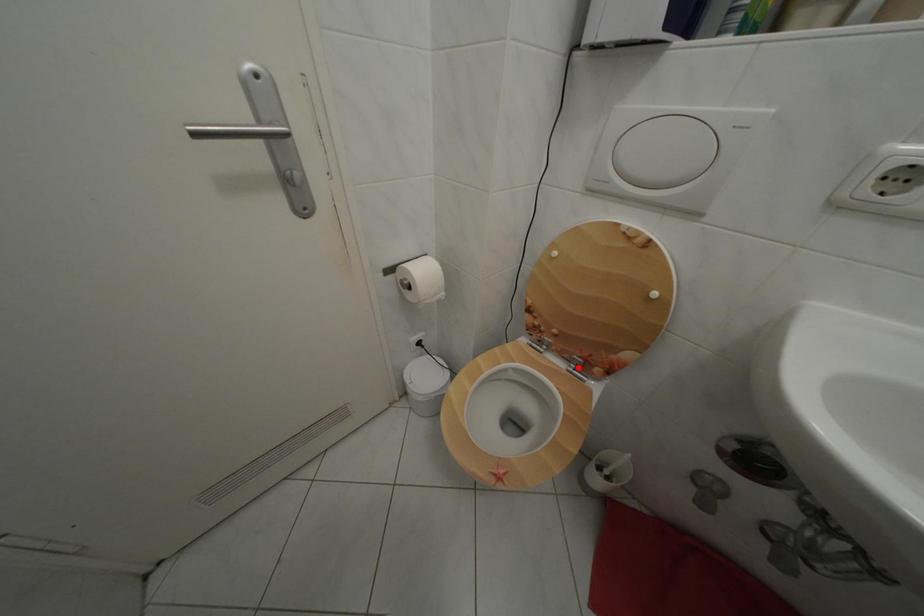
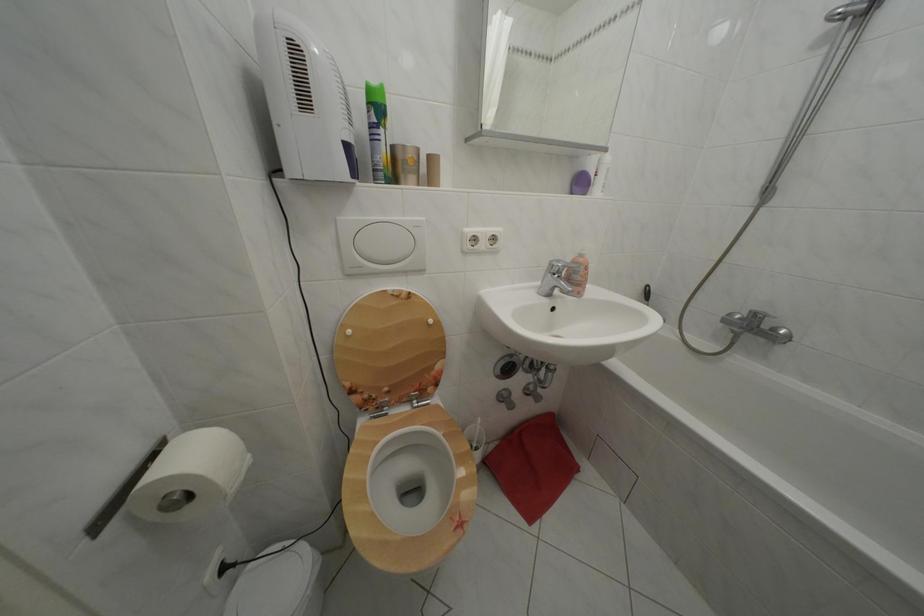
In the second image, find the point that corresponds to the highlighted location in the first image.

(419, 407)